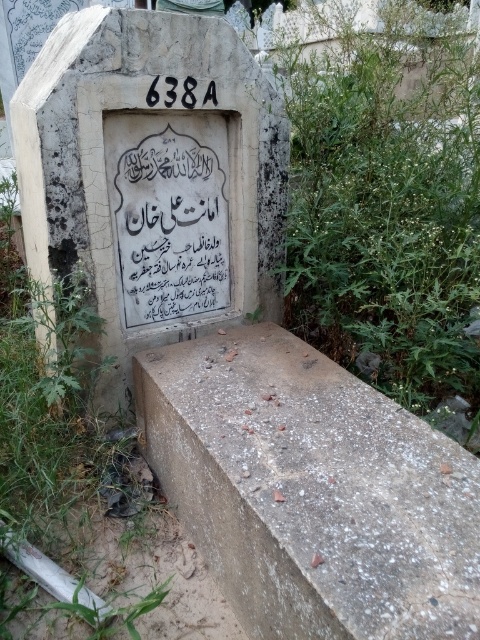
Question: Which point is closer to the camera?

Choices:
 (A) green leafy plant at lower right
 (B) white stone gravestone at center
 (C) gray concrete at lower center

Answer: (C)

Question: Is gray concrete at lower center thinner than white stone gravestone at center?

Choices:
 (A) yes
 (B) no

Answer: (A)

Question: Which point appears farthest from the camera in this image?

Choices:
 (A) (398, 243)
 (B) (335, 572)

Answer: (A)

Question: Which point is closer to the camera?

Choices:
 (A) (359, 202)
 (B) (477, 515)

Answer: (B)

Question: Is gray concrete at lower center further to camera compared to white stone gravestone at center?

Choices:
 (A) no
 (B) yes

Answer: (A)

Question: Is gray concrete at lower center bigger than white stone gravestone at center?

Choices:
 (A) no
 (B) yes

Answer: (A)